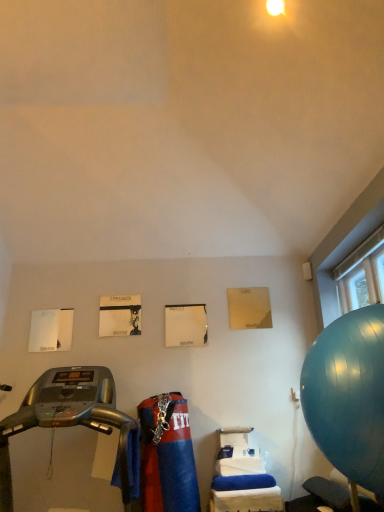
Describe the element at coordinates (348, 394) in the screenshot. I see `blue rubber ball at right` at that location.

Where is `blue rubber ball at right`? This screenshot has width=384, height=512. blue rubber ball at right is located at coordinates (348, 394).

This screenshot has width=384, height=512. Describe the element at coordinates (68, 417) in the screenshot. I see `silver metallic treadmill at left` at that location.

The width and height of the screenshot is (384, 512). Find the location of `silver metallic treadmill at left`. silver metallic treadmill at left is located at coordinates (68, 417).

Locate an element on the screen. blue rubber ball at right is located at coordinates (348, 394).

Is silver metallic treadmill at left at the left side of blue rubber ball at right?

Yes, silver metallic treadmill at left is to the left of blue rubber ball at right.

Considering the positions of objects silver metallic treadmill at left and blue rubber ball at right in the image provided, who is behind, silver metallic treadmill at left or blue rubber ball at right?

Positioned behind is blue rubber ball at right.

Which is nearer, (125, 414) or (353, 361)?

Clearly, point (125, 414) is more distant from the camera than point (353, 361).

From the image's perspective, is silver metallic treadmill at left under blue rubber ball at right?

Yes, from the image's perspective, silver metallic treadmill at left is beneath blue rubber ball at right.

From a real-world perspective, who is located lower, silver metallic treadmill at left or blue rubber ball at right?

silver metallic treadmill at left.

Looking at their sizes, would you say silver metallic treadmill at left is wider or thinner than blue rubber ball at right?

Considering their sizes, silver metallic treadmill at left looks broader than blue rubber ball at right.

Who is shorter, silver metallic treadmill at left or blue rubber ball at right?

With less height is blue rubber ball at right.

In terms of size, does silver metallic treadmill at left appear bigger or smaller than blue rubber ball at right?

Clearly, silver metallic treadmill at left is larger in size than blue rubber ball at right.

Do you think silver metallic treadmill at left is within blue rubber ball at right, or outside of it?

silver metallic treadmill at left is located beyond the bounds of blue rubber ball at right.

Would you say silver metallic treadmill at left is a long distance from blue rubber ball at right?

Indeed, silver metallic treadmill at left is not near blue rubber ball at right.

Is silver metallic treadmill at left facing towards blue rubber ball at right?

No, silver metallic treadmill at left is not turned towards blue rubber ball at right.

Can you tell me how much silver metallic treadmill at left and blue rubber ball at right differ in facing direction?

The facing directions of silver metallic treadmill at left and blue rubber ball at right are 89.5 degrees apart.

Locate an element on the screen. treadmill in front of the blue rubber ball at right is located at coordinates (68, 417).

Which is more to the left, blue rubber ball at right or silver metallic treadmill at left?

silver metallic treadmill at left is more to the left.

Is the position of blue rubber ball at right less distant than that of silver metallic treadmill at left?

No, blue rubber ball at right is further to the viewer.

Considering the positions of point (353, 406) and point (55, 397), is point (353, 406) closer or farther from the camera than point (55, 397)?

Point (353, 406) is closer to the camera than point (55, 397).

Based on the photo, from the image's perspective, does blue rubber ball at right appear higher than silver metallic treadmill at left?

Yes.

From a real-world perspective, is blue rubber ball at right above or below silver metallic treadmill at left?

From a real-world perspective, blue rubber ball at right is physically above silver metallic treadmill at left.

Which of these two, blue rubber ball at right or silver metallic treadmill at left, is wider?

silver metallic treadmill at left is wider.

From their relative heights in the image, would you say blue rubber ball at right is taller or shorter than silver metallic treadmill at left?

In the image, blue rubber ball at right appears to be shorter than silver metallic treadmill at left.

Considering the sizes of blue rubber ball at right and silver metallic treadmill at left in the image, is blue rubber ball at right bigger or smaller than silver metallic treadmill at left?

Considering their sizes, blue rubber ball at right takes up less space than silver metallic treadmill at left.

Can silver metallic treadmill at left be found inside blue rubber ball at right?

No, blue rubber ball at right does not contain silver metallic treadmill at left.

Are blue rubber ball at right and silver metallic treadmill at left beside each other?

blue rubber ball at right is not next to silver metallic treadmill at left, and they're not touching.

Is blue rubber ball at right aimed at silver metallic treadmill at left?

Yes, blue rubber ball at right is facing silver metallic treadmill at left.

How many degrees apart are the facing directions of blue rubber ball at right and silver metallic treadmill at left?

The angular difference between blue rubber ball at right and silver metallic treadmill at left is 89.5 degrees.

Image resolution: width=384 pixels, height=512 pixels. I want to click on treadmill below the blue rubber ball at right (from a real-world perspective), so click(x=68, y=417).

Where is `ball located behind the silver metallic treadmill at left`? ball located behind the silver metallic treadmill at left is located at coordinates (348, 394).

There is a silver metallic treadmill at left. At what (x,y) coordinates should I click in order to perform the action: click on ball above it (from a real-world perspective). Please return your answer as a coordinate pair (x, y). This screenshot has height=512, width=384. Looking at the image, I should click on (348, 394).